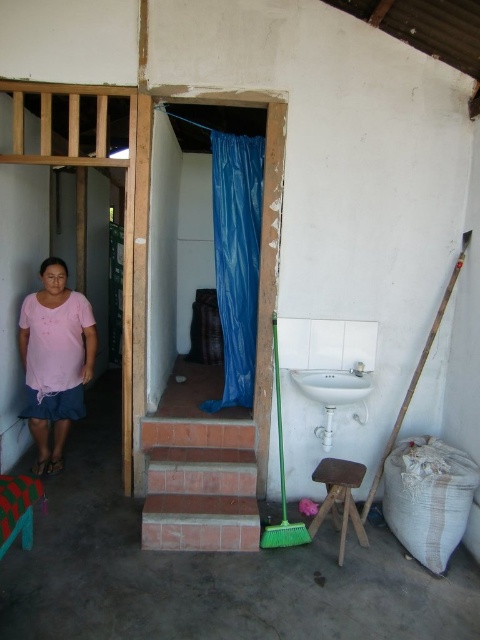
You are a delivery person trying to navigate through the bathroom. You see the brick stairs at lower left and the pink fabric skirt at lower left. Which object is wider?

The brick stairs at lower left might be wider than the pink fabric skirt at lower left.

You are standing in the bathroom and want to exit through the doorway covered by the blue plastic curtain. To do so, you must first move away from the brick stairs at lower left. In which general direction should you move?

You should move towards the right side of the image, away from the brick stairs at lower left, since the doorway with the blue plastic curtain is located near the entrance opposite the stairs.